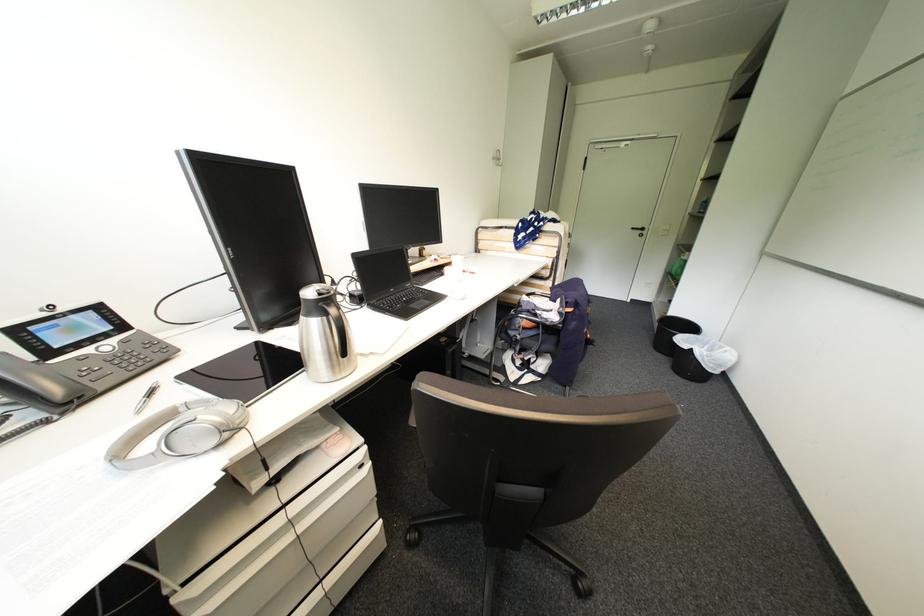
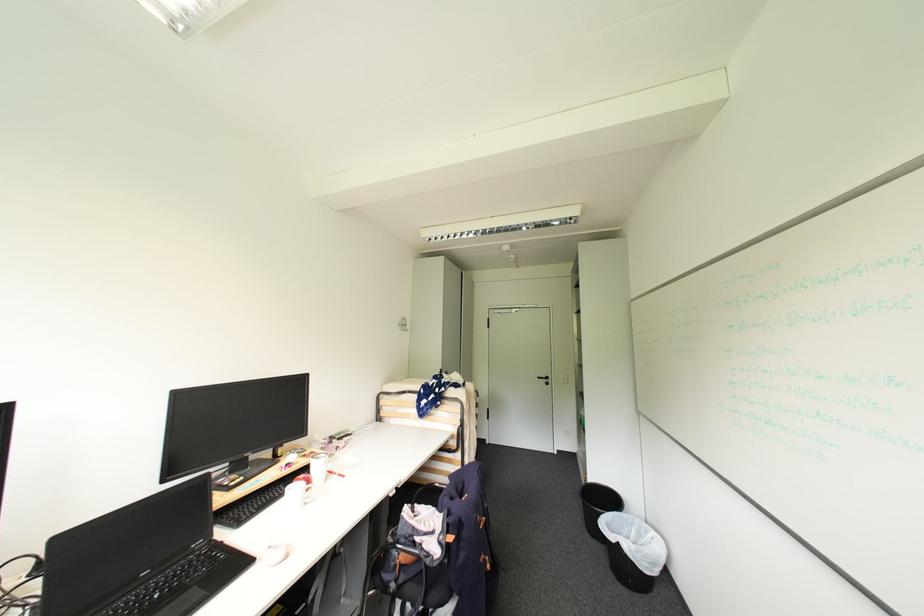
Locate, in the second image, the point that corresponds to pixel 500 159 in the first image.

(406, 325)